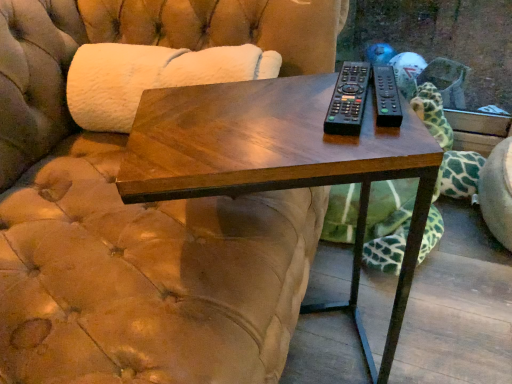
Question: Considering the positions of point (411, 130) and point (394, 243), is point (411, 130) closer or farther from the camera than point (394, 243)?

Choices:
 (A) farther
 (B) closer

Answer: (B)

Question: Is dark wood table at center situated inside green spotted fabric at right or outside?

Choices:
 (A) inside
 (B) outside

Answer: (B)

Question: Which is nearer to the green spotted fabric at right?

Choices:
 (A) black plastic remote at center, positioned as the 1th remote in right-to-left order
 (B) black plastic remote at center, the 2th remote positioned from the right
 (C) dark wood table at center

Answer: (C)

Question: Based on their relative distances, which object is nearer to the black plastic remote at center, acting as the second remote starting from the left?

Choices:
 (A) green spotted fabric at right
 (B) black plastic remote at center, the first remote when ordered from left to right
 (C) dark wood table at center

Answer: (B)